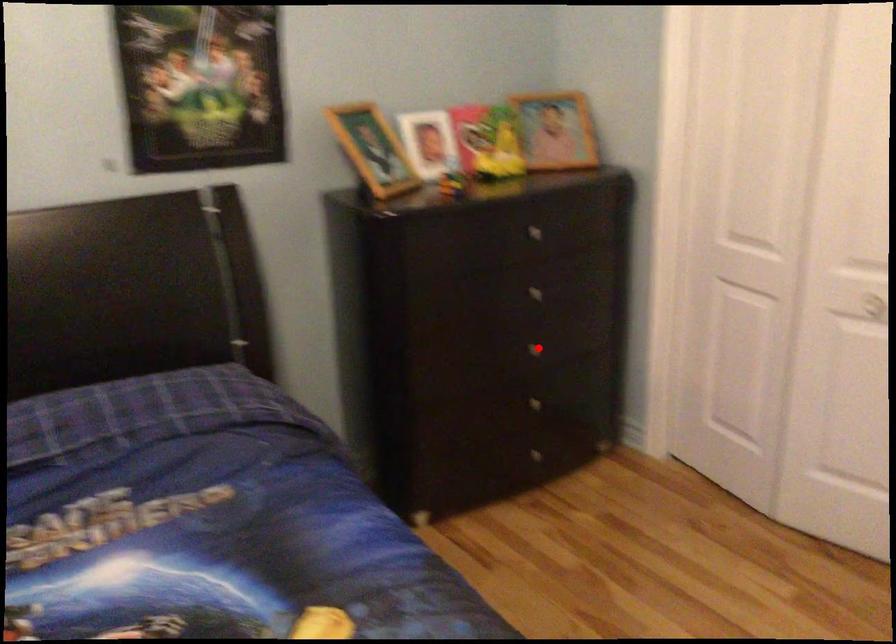
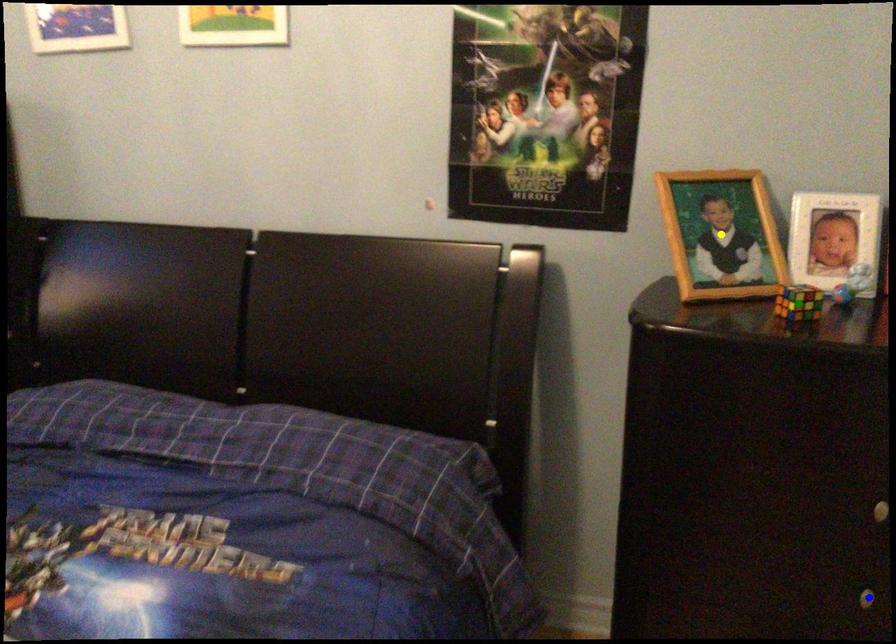
Question: I am providing you with two images of the same scene from different viewpoints. A red point is marked on the first image. You are given multiple points on the second image. Can you choose the point in image 2 that corresponds to the point in image 1?

Choices:
 (A) blue point
 (B) yellow point
 (C) green point

Answer: (A)